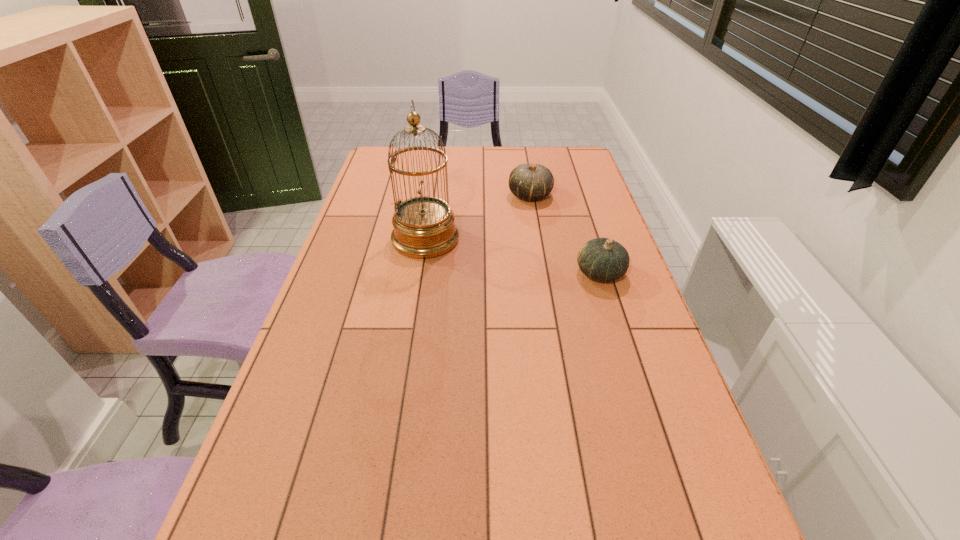
At what (x,y) coordinates should I click in order to perform the action: click on vacant region that satisfies the following two spatial constraints: 1. with an open door on the birdcage; 2. on the left side of the right gourd. Please return your answer as a coordinate pair (x, y). The width and height of the screenshot is (960, 540). Looking at the image, I should click on [x=420, y=273].

I want to click on vacant space that satisfies the following two spatial constraints: 1. on the back side of the right gourd; 2. with an open door on the birdcage, so click(589, 239).

This screenshot has height=540, width=960. I want to click on free spot that satisfies the following two spatial constraints: 1. on the back side of the right gourd; 2. with an open door on the birdcage, so click(x=589, y=239).

This screenshot has width=960, height=540. What are the coordinates of `vacant region that satisfies the following two spatial constraints: 1. with an open door on the nearer gourd; 2. on the left side of the tallest object` in the screenshot? It's located at (420, 273).

Where is `free location that satisfies the following two spatial constraints: 1. with an open door on the leftmost object; 2. on the back side of the right gourd`? The height and width of the screenshot is (540, 960). free location that satisfies the following two spatial constraints: 1. with an open door on the leftmost object; 2. on the back side of the right gourd is located at coordinates (420, 273).

Where is `vacant space that satisfies the following two spatial constraints: 1. with an open door on the leftmost object; 2. on the left side of the rightmost object`? This screenshot has width=960, height=540. vacant space that satisfies the following two spatial constraints: 1. with an open door on the leftmost object; 2. on the left side of the rightmost object is located at coordinates (420, 273).